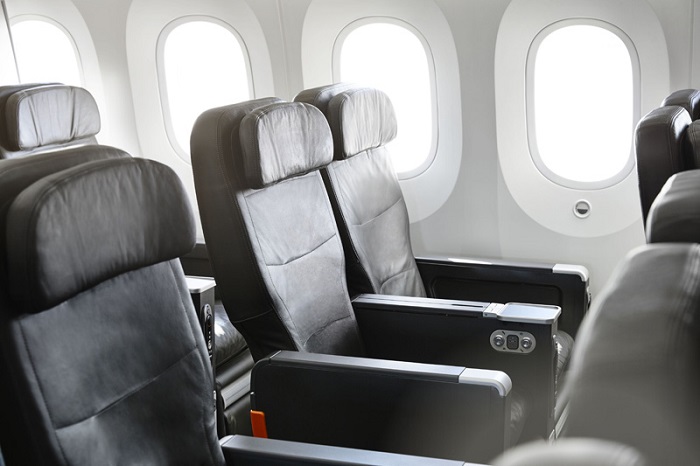
What are the coordinates of `chairs` in the screenshot? It's located at (54, 114), (94, 266), (276, 155), (346, 134), (644, 347), (694, 185), (658, 137), (682, 97), (575, 450).